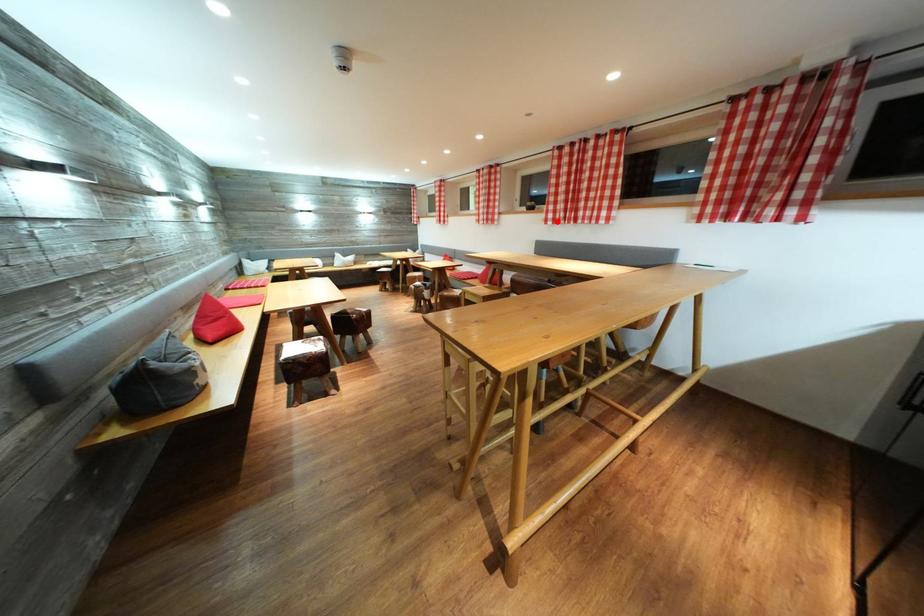
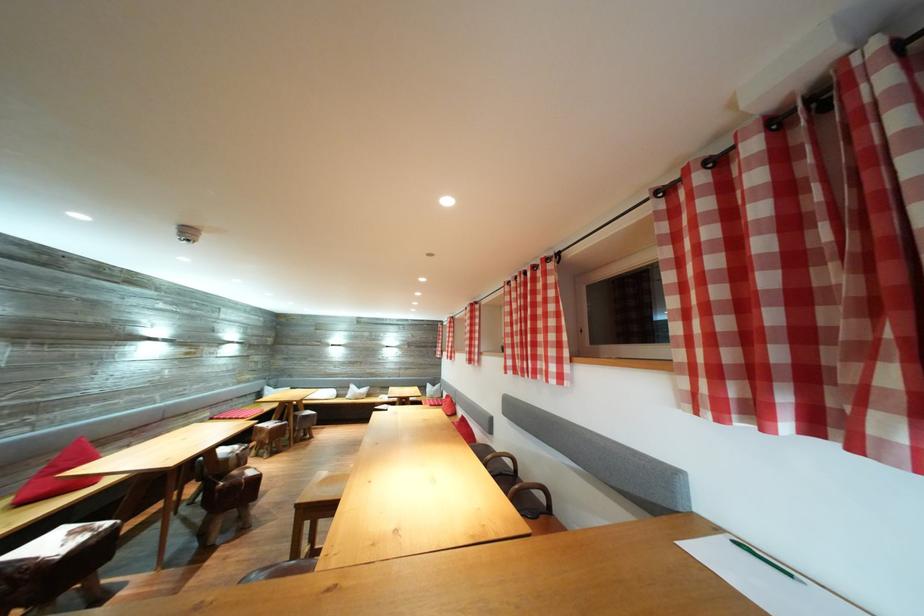
Question: I am providing you with two images of the same scene from different viewpoints. Given a red point in image1, look at the same physical point in image2. Is it:

Choices:
 (A) Closer to the viewpoint
 (B) Farther from the viewpoint

Answer: (B)